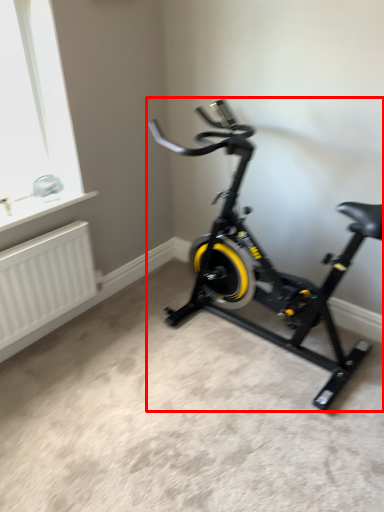
Question: From the image's perspective, where is stationary bicycle (annotated by the red box) located relative to radiator?

Choices:
 (A) above
 (B) below

Answer: (A)